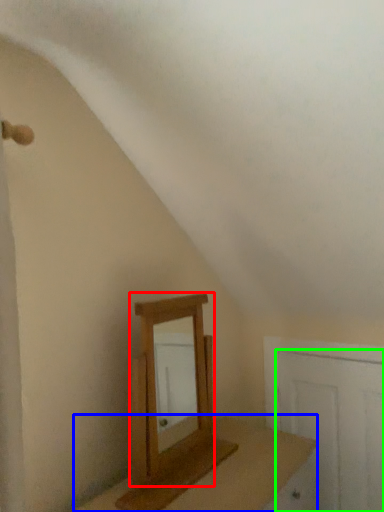
Question: Which object is positioned farthest from mirror (highlighted by a red box)? Select from table (highlighted by a blue box) and door (highlighted by a green box).

Choices:
 (A) table
 (B) door

Answer: (B)